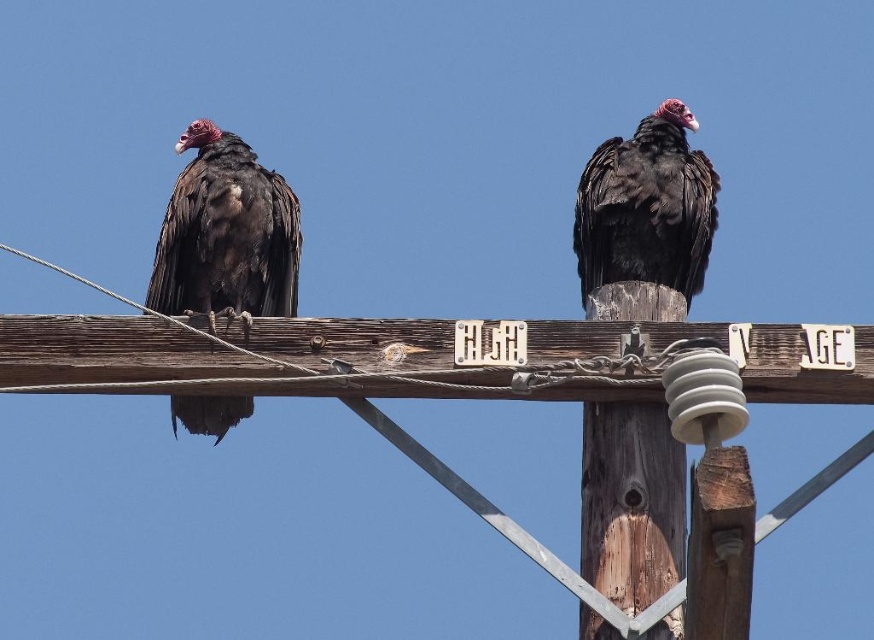
Question: Among these points, which one is nearest to the camera?

Choices:
 (A) (397, 376)
 (B) (637, 150)

Answer: (A)

Question: Which point appears closest to the camera in this image?

Choices:
 (A) [681, 163]
 (B) [621, 602]

Answer: (B)

Question: Is wooden pole at center bigger than black matte vulture at upper right?

Choices:
 (A) yes
 (B) no

Answer: (A)

Question: Which point is farther from the camera taking this photo?

Choices:
 (A) (664, 493)
 (B) (820, 352)
 (C) (182, 220)

Answer: (C)

Question: Is wooden pole at center positioned behind matte black vulture at left?

Choices:
 (A) no
 (B) yes

Answer: (A)

Question: Does weathered wood post at center appear under black matte vulture at upper right?

Choices:
 (A) no
 (B) yes

Answer: (B)